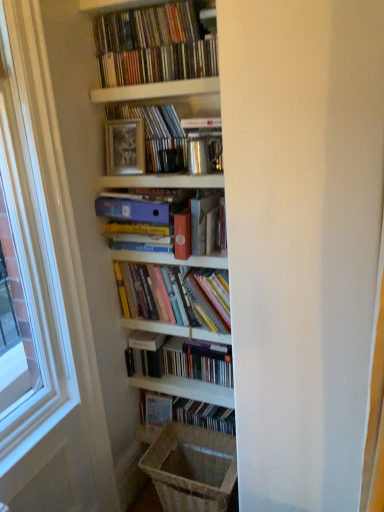
Question: Which direction should I rotate to face matte black books at center, which is counted as the 1th book, starting from the bottom, — up or down?

Choices:
 (A) down
 (B) up

Answer: (A)

Question: Does hardcover books at center, which ranks as the third book in bottom-to-top order, have a lesser width compared to hardcover book at center, which is the fifth book in bottom-to-top order?

Choices:
 (A) no
 (B) yes

Answer: (A)

Question: Is hardcover books at center, which is counted as the 4th book, starting from the top, in front of hardcover book at center, which is the fifth book in bottom-to-top order?

Choices:
 (A) yes
 (B) no

Answer: (B)

Question: Could you tell me if hardcover books at center, which ranks as the third book in bottom-to-top order, is facing hardcover book at center, the 2th book when ordered from top to bottom?

Choices:
 (A) yes
 (B) no

Answer: (B)

Question: Are hardcover books at center, which ranks as the third book in bottom-to-top order, and hardcover book at center, the 2th book when ordered from top to bottom, located far from each other?

Choices:
 (A) no
 (B) yes

Answer: (A)

Question: From the image's perspective, is hardcover books at center, which is counted as the 4th book, starting from the top, below hardcover book at center, which is the fifth book in bottom-to-top order?

Choices:
 (A) no
 (B) yes

Answer: (B)

Question: Is hardcover books at center, which ranks as the third book in bottom-to-top order, to the right of hardcover book at center, which is the fifth book in bottom-to-top order, from the viewer's perspective?

Choices:
 (A) no
 (B) yes

Answer: (B)

Question: Considering the relative positions of matte plastic folder at center, which ranks as the 4th book in bottom-to-top order, and white wood window frame at left in the image provided, is matte plastic folder at center, which ranks as the 4th book in bottom-to-top order, to the right of white wood window frame at left from the viewer's perspective?

Choices:
 (A) no
 (B) yes

Answer: (B)

Question: Is matte plastic folder at center, which ranks as the 3th book in top-to-bottom order, shorter than white wood window frame at left?

Choices:
 (A) no
 (B) yes

Answer: (B)

Question: Is matte plastic folder at center, which ranks as the 4th book in bottom-to-top order, completely or partially outside of white wood window frame at left?

Choices:
 (A) no
 (B) yes

Answer: (B)

Question: Is the depth of matte plastic folder at center, which ranks as the 3th book in top-to-bottom order, greater than that of white wood window frame at left?

Choices:
 (A) yes
 (B) no

Answer: (A)

Question: Does matte plastic folder at center, which ranks as the 3th book in top-to-bottom order, have a greater width compared to white wood window frame at left?

Choices:
 (A) no
 (B) yes

Answer: (B)

Question: Considering the relative sizes of matte plastic folder at center, which ranks as the 3th book in top-to-bottom order, and white wood window frame at left in the image provided, is matte plastic folder at center, which ranks as the 3th book in top-to-bottom order, thinner than white wood window frame at left?

Choices:
 (A) no
 (B) yes

Answer: (A)

Question: Can you confirm if matte black books at center, which is counted as the 1th book, starting from the bottom, is smaller than brown woven laundry basket at lower center?

Choices:
 (A) yes
 (B) no

Answer: (B)